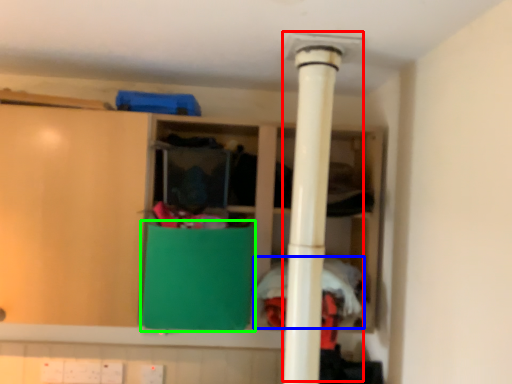
Question: Which is nearer to the water heater (highlighted by a red box)? clothing (highlighted by a blue box) or cabinetry (highlighted by a green box).

Choices:
 (A) clothing
 (B) cabinetry

Answer: (B)